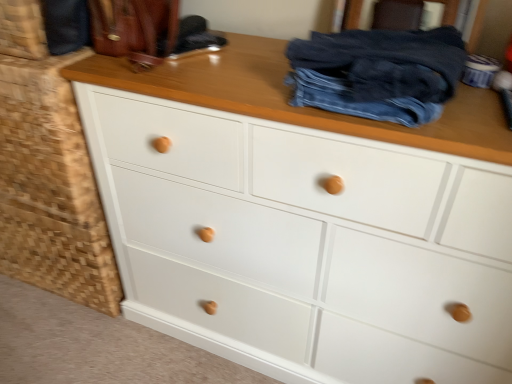
Question: From a real-world perspective, relative to white wood drawer at lower left, is denim at center vertically above or below?

Choices:
 (A) below
 (B) above

Answer: (B)

Question: From the image's perspective, relative to white wood drawer at lower left, is denim at center above or below?

Choices:
 (A) above
 (B) below

Answer: (A)

Question: Based on their sizes in the image, would you say denim at center is bigger or smaller than white wood drawer at lower left?

Choices:
 (A) big
 (B) small

Answer: (B)

Question: Is white wood drawer at lower left spatially inside denim at center, or outside of it?

Choices:
 (A) outside
 (B) inside

Answer: (A)

Question: From the image's perspective, is white wood drawer at lower left positioned above or below denim at center?

Choices:
 (A) above
 (B) below

Answer: (B)

Question: Would you say white wood drawer at lower left is to the left or to the right of denim at center in the picture?

Choices:
 (A) right
 (B) left

Answer: (B)

Question: From a real-world perspective, is white wood drawer at lower left physically located above or below denim at center?

Choices:
 (A) above
 (B) below

Answer: (B)